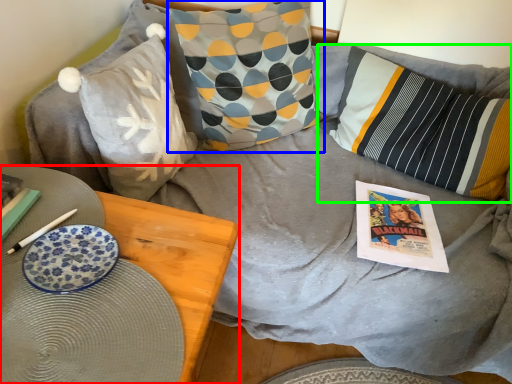
Question: Estimate the real-world distances between objects in this image. Which object is farther from furniture (highlighted by a red box), pillow (highlighted by a blue box) or pillow (highlighted by a green box)?

Choices:
 (A) pillow
 (B) pillow

Answer: (B)